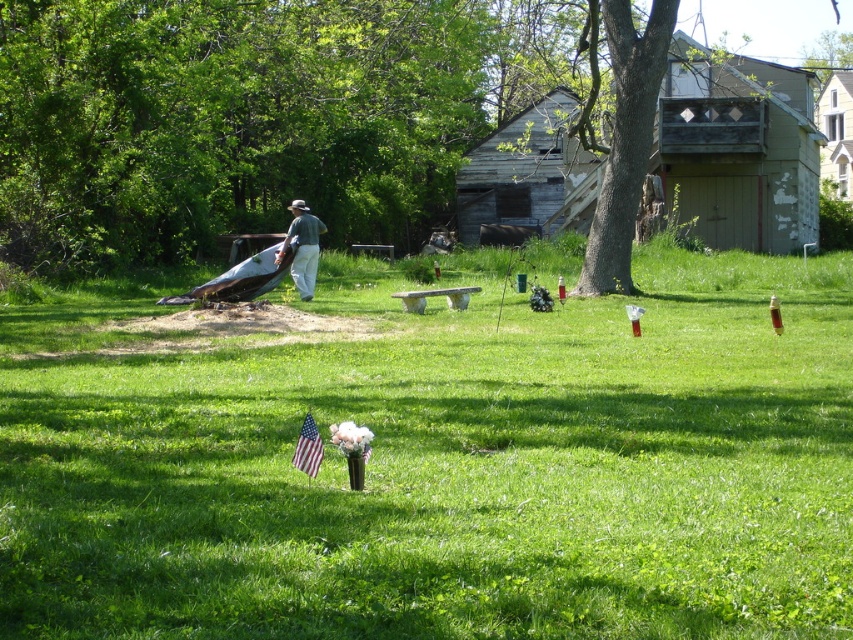
Question: Can you confirm if green leafy tree at upper left is thinner than american flag at center?

Choices:
 (A) no
 (B) yes

Answer: (A)

Question: Does green leafy tree at upper left appear over green cotton shirt at center?

Choices:
 (A) no
 (B) yes

Answer: (B)

Question: Which point is farther to the camera?

Choices:
 (A) wooden bench at center
 (B) american flag at center
 (C) green leafy tree at upper left

Answer: (C)

Question: Which point is farther from the camera taking this photo?

Choices:
 (A) (299, 289)
 (B) (811, 364)

Answer: (A)

Question: Observing the image, what is the correct spatial positioning of wooden bench at center in reference to green leafy tree at upper left?

Choices:
 (A) below
 (B) above

Answer: (A)

Question: Which object appears farthest from the camera in this image?

Choices:
 (A) wooden bench at center
 (B) green leafy tree at upper left

Answer: (B)